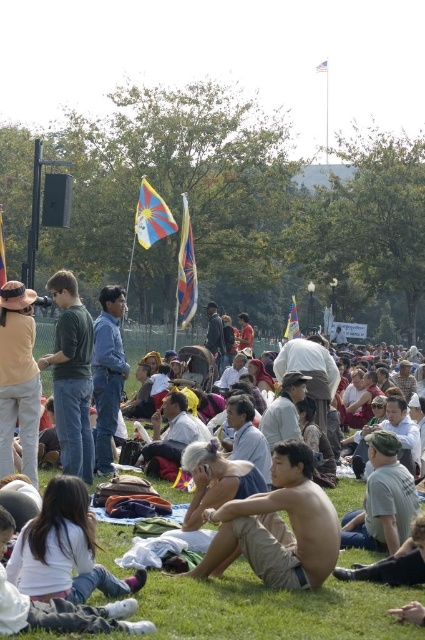
You are a photographer at the event and want to capture both the tan cotton shirt at center and the green cotton shirt at center in a single shot. Which shirt should you focus on first to ensure both are in frame?

The tan cotton shirt at center is located below the green cotton shirt at center, so you should focus on the green cotton shirt at center first to ensure both are in frame.

You are at a park event and see two items at the center of the scene. The tan shorts at center and the green cotton shirt at center. Which item is closer to the ground?

The tan shorts at center is positioned under green cotton shirt at center, so the tan shorts at center is closer to the ground.

You are a photographer at the event and want to capture both the tan shorts at center and the green cotton shirt at center in the same frame. Since you can only focus on one subject at a time, which one should you focus on to ensure the other is still visible in the background?

You should focus on the tan shorts at center because it is in front of the green cotton shirt at center, so the green cotton shirt at center will naturally appear in the background if the tan shorts at center is in focus.